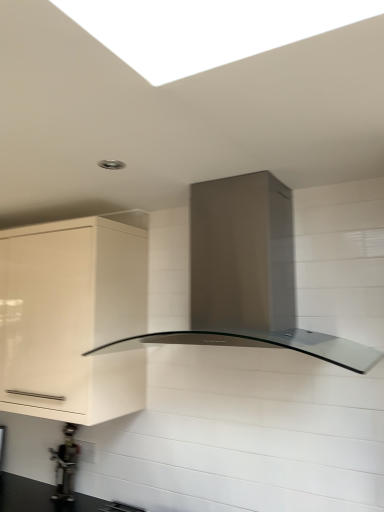
Question: Is metallic gray water heater at lower left taller than white glossy cabinet at left?

Choices:
 (A) no
 (B) yes

Answer: (A)

Question: Could you tell me if metallic gray water heater at lower left is facing white glossy cabinet at left?

Choices:
 (A) no
 (B) yes

Answer: (A)

Question: Is metallic gray water heater at lower left wider than white glossy cabinet at left?

Choices:
 (A) yes
 (B) no

Answer: (B)

Question: From the image's perspective, is metallic gray water heater at lower left below white glossy cabinet at left?

Choices:
 (A) yes
 (B) no

Answer: (A)

Question: Can you confirm if metallic gray water heater at lower left is positioned to the left of white glossy cabinet at left?

Choices:
 (A) yes
 (B) no

Answer: (B)

Question: Can you confirm if metallic gray water heater at lower left is shorter than white glossy cabinet at left?

Choices:
 (A) yes
 (B) no

Answer: (A)

Question: Is white glossy cabinet at left to the left of satin metallic range hood at center from the viewer's perspective?

Choices:
 (A) no
 (B) yes

Answer: (B)

Question: Is satin metallic range hood at center inside white glossy cabinet at left?

Choices:
 (A) no
 (B) yes

Answer: (A)

Question: Can you confirm if white glossy cabinet at left is thinner than satin metallic range hood at center?

Choices:
 (A) no
 (B) yes

Answer: (B)

Question: Does white glossy cabinet at left turn towards satin metallic range hood at center?

Choices:
 (A) no
 (B) yes

Answer: (A)

Question: From the image's perspective, is white glossy cabinet at left over satin metallic range hood at center?

Choices:
 (A) yes
 (B) no

Answer: (B)

Question: Is there a large distance between white glossy cabinet at left and satin metallic range hood at center?

Choices:
 (A) no
 (B) yes

Answer: (A)

Question: Is satin metallic range hood at center to the right of white glossy cabinet at left from the viewer's perspective?

Choices:
 (A) no
 (B) yes

Answer: (B)